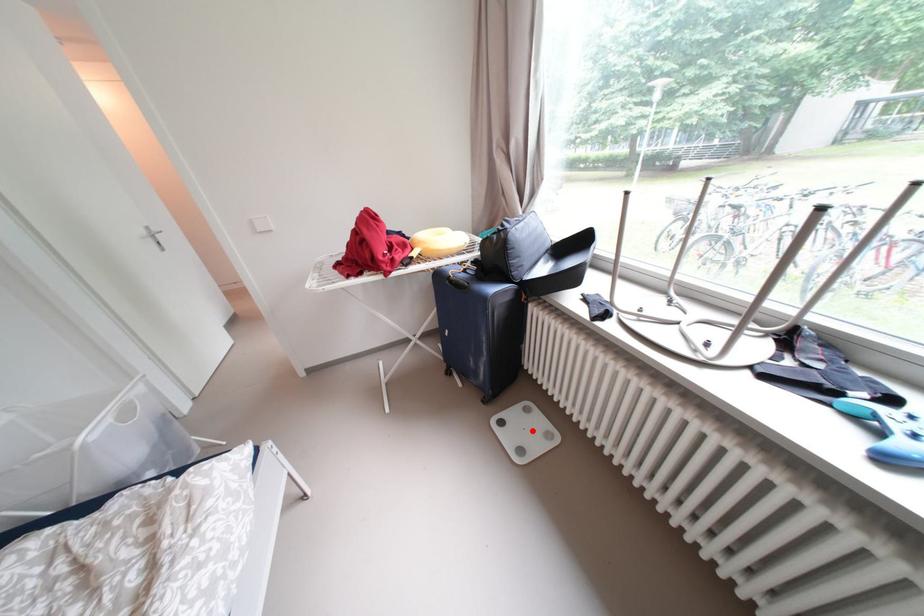
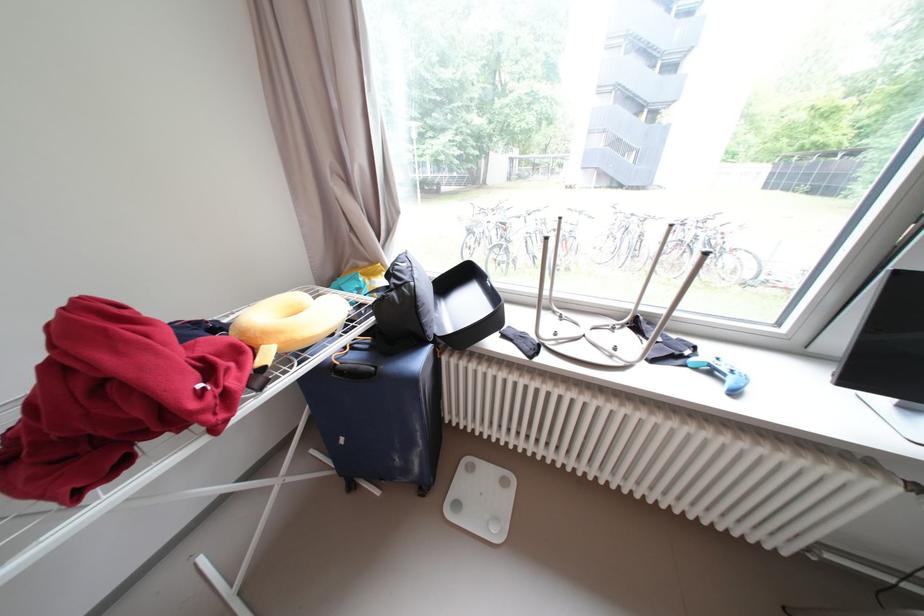
Question: I am providing you with two images of the same scene from different viewpoints. Image1 has a red point marked. In image2, the corresponding 3D location appears at what relative position? Reply with the corresponding letter.

Choices:
 (A) Closer
 (B) Farther

Answer: (A)